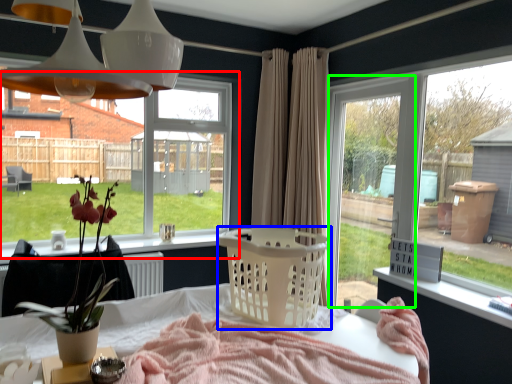
Question: Considering the real-world distances, which object is farthest from window (highlighted by a red box)? basket (highlighted by a blue box) or window frame (highlighted by a green box)?

Choices:
 (A) basket
 (B) window frame

Answer: (A)